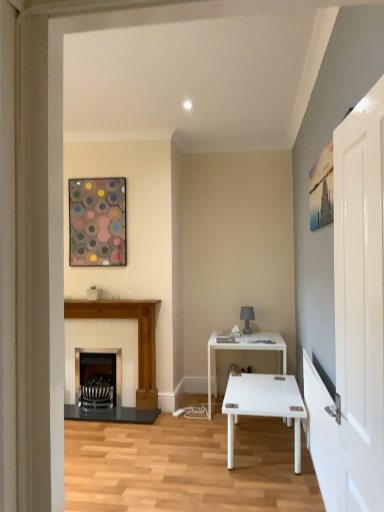
Question: Is wooden fireplace at left, the first fireplace when ordered from right to left, not within metallic hexagonal artwork at upper left?

Choices:
 (A) yes
 (B) no

Answer: (A)

Question: Is wooden fireplace at left, the first fireplace when ordered from right to left, looking in the opposite direction of metallic hexagonal artwork at upper left?

Choices:
 (A) no
 (B) yes

Answer: (A)

Question: Are wooden fireplace at left, placed as the second fireplace when sorted from left to right, and metallic hexagonal artwork at upper left making contact?

Choices:
 (A) no
 (B) yes

Answer: (A)

Question: Is wooden fireplace at left, placed as the second fireplace when sorted from left to right, at the left side of metallic hexagonal artwork at upper left?

Choices:
 (A) yes
 (B) no

Answer: (B)

Question: From a real-world perspective, is wooden fireplace at left, the first fireplace when ordered from right to left, on top of metallic hexagonal artwork at upper left?

Choices:
 (A) yes
 (B) no

Answer: (B)

Question: From the image's perspective, is black metal fireplace at center, the 2th fireplace in the right-to-left sequence, positioned above or below wooden fireplace at left, placed as the second fireplace when sorted from left to right?

Choices:
 (A) above
 (B) below

Answer: (B)

Question: Considering their positions, is black metal fireplace at center, the 2th fireplace in the right-to-left sequence, located in front of or behind wooden fireplace at left, placed as the second fireplace when sorted from left to right?

Choices:
 (A) behind
 (B) front

Answer: (A)

Question: Which is correct: black metal fireplace at center, acting as the 1th fireplace starting from the left, is inside wooden fireplace at left, placed as the second fireplace when sorted from left to right, or outside of it?

Choices:
 (A) inside
 (B) outside

Answer: (A)

Question: From a real-world perspective, is black metal fireplace at center, the 2th fireplace in the right-to-left sequence, physically located above or below wooden fireplace at left, placed as the second fireplace when sorted from left to right?

Choices:
 (A) above
 (B) below

Answer: (B)

Question: From the image's perspective, is white glossy door at right above or below white glossy table at center?

Choices:
 (A) below
 (B) above

Answer: (B)

Question: From a real-world perspective, is white glossy door at right positioned above or below white glossy table at center?

Choices:
 (A) below
 (B) above

Answer: (B)

Question: Is white glossy door at right bigger or smaller than white glossy table at center?

Choices:
 (A) small
 (B) big

Answer: (A)

Question: In terms of height, does white glossy door at right look taller or shorter compared to white glossy table at center?

Choices:
 (A) tall
 (B) short

Answer: (A)

Question: From the image's perspective, is wooden fireplace at left, the first fireplace when ordered from right to left, located above or below matte gray lamp at center?

Choices:
 (A) above
 (B) below

Answer: (B)

Question: From a real-world perspective, is wooden fireplace at left, placed as the second fireplace when sorted from left to right, above or below matte gray lamp at center?

Choices:
 (A) below
 (B) above

Answer: (A)